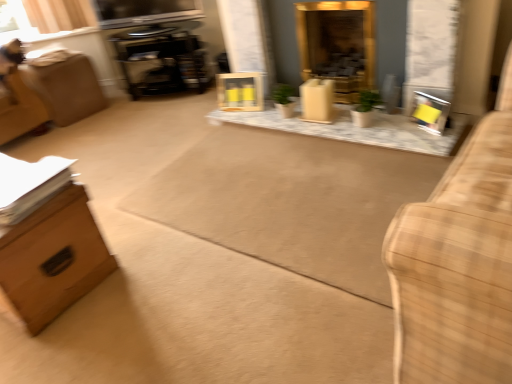
Question: In terms of width, does yellow cardboard picture frame at right, marked as the 1th picture frame in a right-to-left arrangement, look wider or thinner when compared to wooden frame at center, placed as the 2th picture frame when sorted from bottom to top?

Choices:
 (A) thin
 (B) wide

Answer: (A)

Question: In the image, is yellow cardboard picture frame at right, which ranks as the first picture frame in bottom-to-top order, positioned in front of or behind wooden frame at center, the first picture frame in the top-to-bottom sequence?

Choices:
 (A) behind
 (B) front

Answer: (B)

Question: Which is farther from the plaid fabric couch at right?

Choices:
 (A) yellow cardboard picture frame at right, which is the 1th picture frame in front-to-back order
 (B) wooden swivel chair at left
 (C) wooden frame at center, positioned as the first picture frame in back-to-front order
 (D) wooden table at center
 (E) black glossy entertainment center at upper left

Answer: (E)

Question: Which object is the closest to the matte wood box at center?

Choices:
 (A) gold metallic fireplace at center
 (B) yellow cardboard picture frame at right, the 2th picture frame viewed from the left
 (C) wooden swivel chair at left
 (D) brown cardboard box at left
 (E) plaid fabric couch at right

Answer: (A)